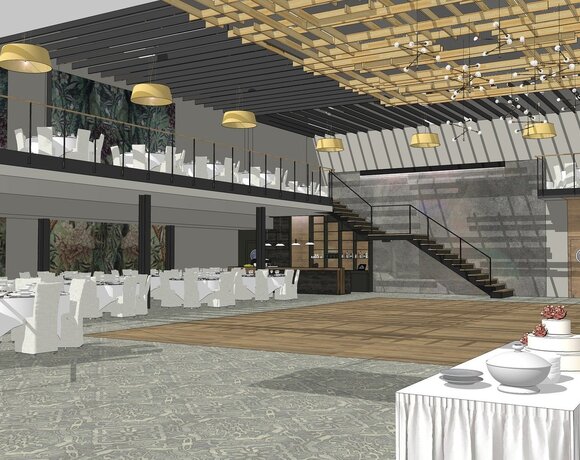
Where is `table and chairs on upper level`? table and chairs on upper level is located at coordinates (67, 145), (148, 154), (216, 165), (270, 177), (304, 182), (569, 179).